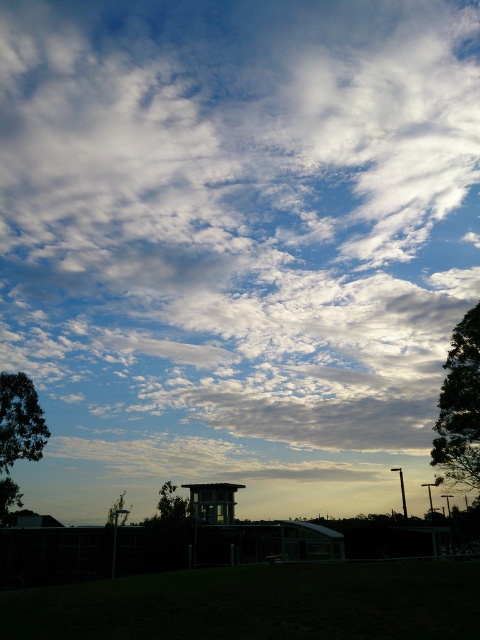
You are standing in the middle of the grassy area and want to walk towards the green leafy tree at lower center. Which direction should you walk to avoid the green leafy tree at right?

Answer: Since the green leafy tree at right is to the right of the green leafy tree at lower center, you should walk towards the left direction to avoid the green leafy tree at right and head towards the green leafy tree at lower center.